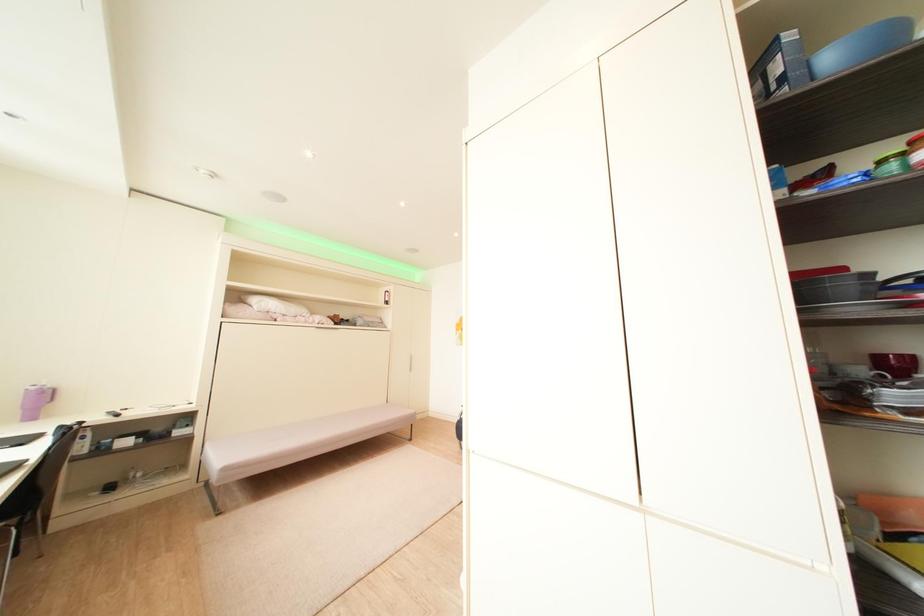
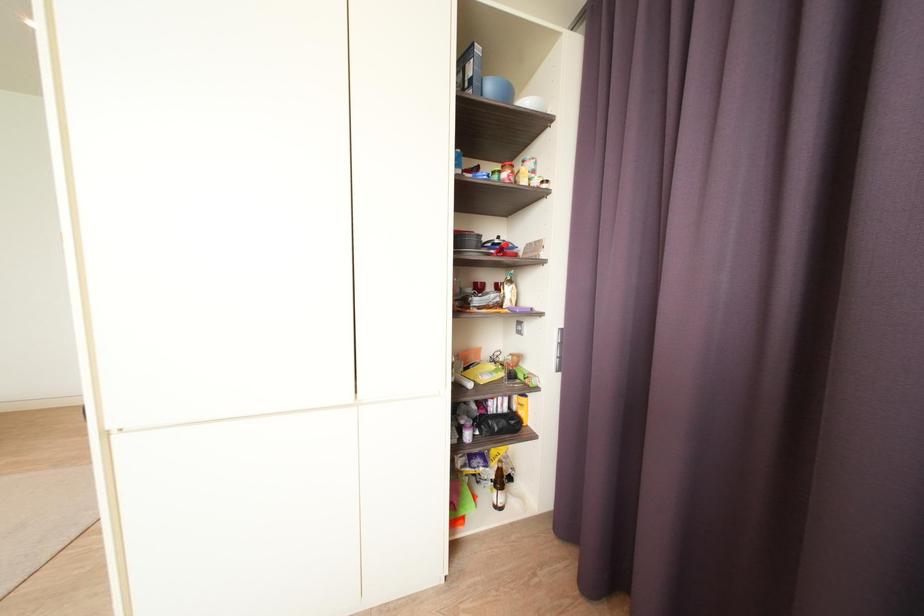
Question: The first image is from the beginning of the video and the second image is from the end. How did the camera likely rotate when shooting the video?

Choices:
 (A) Left
 (B) Right
 (C) Up
 (D) Down

Answer: (B)